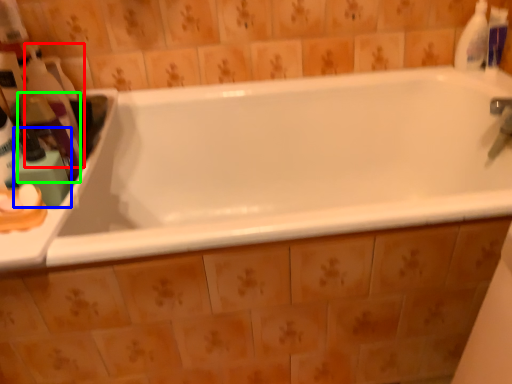
Question: Which is farther away from cleaning product (highlighted by a red box)? toiletry (highlighted by a blue box) or cleaning product (highlighted by a green box)?

Choices:
 (A) toiletry
 (B) cleaning product

Answer: (A)